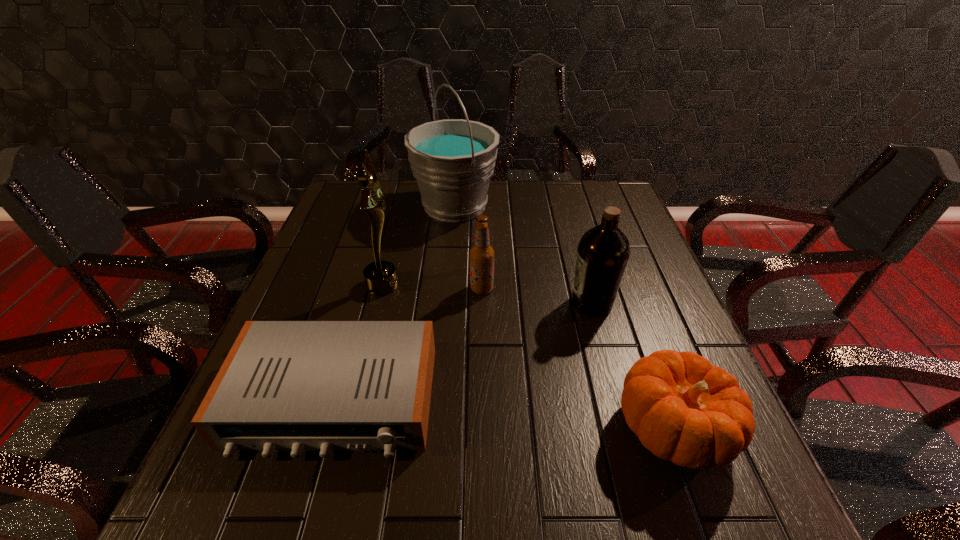
Where is `free space that satisfies the following two spatial constraints: 1. on the front-facing side of the award; 2. on the back side of the fifth tallest object`? free space that satisfies the following two spatial constraints: 1. on the front-facing side of the award; 2. on the back side of the fifth tallest object is located at coordinates [347, 429].

This screenshot has width=960, height=540. Find the location of `free space that satisfies the following two spatial constraints: 1. on the label of the second shortest object; 2. on the left side of the third tallest object`. free space that satisfies the following two spatial constraints: 1. on the label of the second shortest object; 2. on the left side of the third tallest object is located at coordinates (626, 429).

The image size is (960, 540). I want to click on vacant area in the image that satisfies the following two spatial constraints: 1. on the front label of the fifth tallest object; 2. on the left side of the third shortest object, so click(x=483, y=429).

Where is `free space that satisfies the following two spatial constraints: 1. on the front label of the fifth tallest object; 2. on the right side of the beer bottle`? free space that satisfies the following two spatial constraints: 1. on the front label of the fifth tallest object; 2. on the right side of the beer bottle is located at coordinates (483, 429).

Identify the location of vacant space that satisfies the following two spatial constraints: 1. on the control panel of the shortest object; 2. on the left side of the second shortest object. (325, 429).

Find the location of a particular element. Image resolution: width=960 pixels, height=540 pixels. vacant position in the image that satisfies the following two spatial constraints: 1. on the label of the olive oil; 2. on the left side of the fifth tallest object is located at coordinates (626, 429).